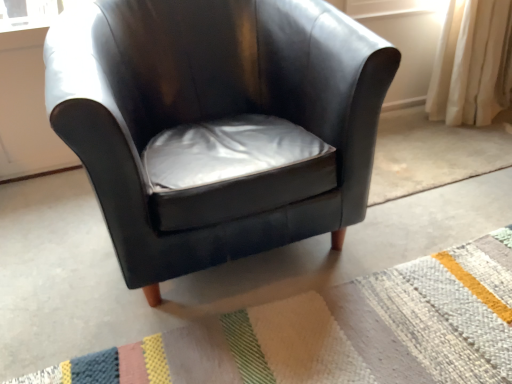
Locate an element on the screen. textured woolen mat at lower right is located at coordinates pyautogui.click(x=339, y=332).

This screenshot has width=512, height=384. Describe the element at coordinates (339, 332) in the screenshot. I see `textured woolen mat at lower right` at that location.

I want to click on matte black armchair at center, so click(x=217, y=124).

This screenshot has width=512, height=384. What do you see at coordinates (217, 124) in the screenshot? I see `matte black armchair at center` at bounding box center [217, 124].

This screenshot has height=384, width=512. Identify the location of textured woolen mat at lower right. (339, 332).

Can you confirm if textured woolen mat at lower right is positioned to the right of matte black armchair at center?

Yes, textured woolen mat at lower right is to the right of matte black armchair at center.

In the scene shown: Which object is closer to the camera, textured woolen mat at lower right or matte black armchair at center?

textured woolen mat at lower right.

Does point (476, 348) appear closer or farther from the camera than point (140, 169)?

Point (476, 348).

From the image's perspective, between textured woolen mat at lower right and matte black armchair at center, which one is located above?

matte black armchair at center is shown above in the image.

Looking at this image, from a real-world perspective, is textured woolen mat at lower right physically below matte black armchair at center?

Correct, in the physical world, textured woolen mat at lower right is lower than matte black armchair at center.

In the scene shown: Between textured woolen mat at lower right and matte black armchair at center, which one has smaller width?

matte black armchair at center is thinner.

Between textured woolen mat at lower right and matte black armchair at center, which one has less height?

textured woolen mat at lower right.

In the scene shown: Looking at the image, does textured woolen mat at lower right seem bigger or smaller compared to matte black armchair at center?

In the image, textured woolen mat at lower right appears to be smaller than matte black armchair at center.

Based on the photo, is textured woolen mat at lower right positioned beyond the bounds of matte black armchair at center?

Indeed, textured woolen mat at lower right is completely outside matte black armchair at center.

Is textured woolen mat at lower right positioned far away from matte black armchair at center?

No, there isn't a large distance between textured woolen mat at lower right and matte black armchair at center.

Consider the image. Is textured woolen mat at lower right facing towards matte black armchair at center?

No, textured woolen mat at lower right does not turn towards matte black armchair at center.

How many degrees apart are the facing directions of textured woolen mat at lower right and matte black armchair at center?

They differ by 88.3 degrees in their facing directions.

You are a GUI agent. You are given a task and a screenshot of the screen. Output one action in this format:
    pyautogui.click(x=<x>, y=<y>)
    Task: Click on the mat located below the matte black armchair at center (from the image's perspective)
    This screenshot has height=384, width=512.
    Given the screenshot: What is the action you would take?
    pyautogui.click(x=339, y=332)

Which is more to the left, matte black armchair at center or textured woolen mat at lower right?

From the viewer's perspective, matte black armchair at center appears more on the left side.

Which is in front, matte black armchair at center or textured woolen mat at lower right?

textured woolen mat at lower right.

Which is behind, point (309, 37) or point (196, 349)?

The point (309, 37) is behind.

From the image's perspective, is matte black armchair at center beneath textured woolen mat at lower right?

Actually, matte black armchair at center appears above textured woolen mat at lower right in the image.

From the picture: From a real-world perspective, is matte black armchair at center physically below textured woolen mat at lower right?

No.

Considering the sizes of objects matte black armchair at center and textured woolen mat at lower right in the image provided, who is wider, matte black armchair at center or textured woolen mat at lower right?

Wider between the two is textured woolen mat at lower right.

Can you confirm if matte black armchair at center is shorter than textured woolen mat at lower right?

No.

Who is bigger, matte black armchair at center or textured woolen mat at lower right?

Bigger between the two is matte black armchair at center.

Is matte black armchair at center not within textured woolen mat at lower right?

Yes.

Is there a large distance between matte black armchair at center and textured woolen mat at lower right?

No.

Is matte black armchair at center turned away from textured woolen mat at lower right?

No, matte black armchair at center is not facing the opposite direction of textured woolen mat at lower right.

Can you tell me how much matte black armchair at center and textured woolen mat at lower right differ in facing direction?

matte black armchair at center and textured woolen mat at lower right are facing 88.3 degrees away from each other.

Where is `chair behind the textured woolen mat at lower right`? The image size is (512, 384). chair behind the textured woolen mat at lower right is located at coordinates (217, 124).

The width and height of the screenshot is (512, 384). I want to click on mat on the right of matte black armchair at center, so click(x=339, y=332).

The width and height of the screenshot is (512, 384). Identify the location of mat in front of the matte black armchair at center. (339, 332).